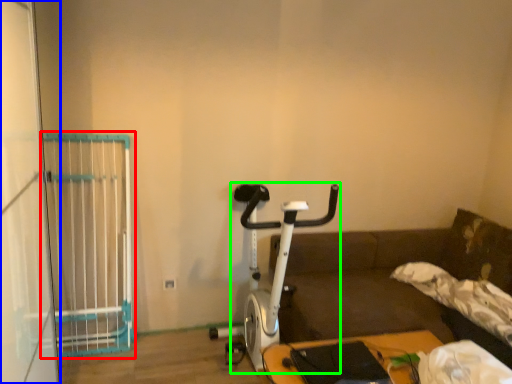
Question: Based on their relative distances, which object is farther from cage (highlighted by a red box)? Choose from screen door (highlighted by a blue box) and stationary bicycle (highlighted by a green box).

Choices:
 (A) screen door
 (B) stationary bicycle

Answer: (B)